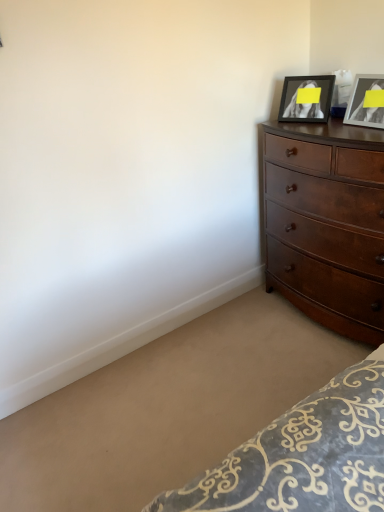
How much space does matte black picture frame at upper right, the second picture frame positioned from the left, occupy horizontally?

3.78 inches.

Measure the distance between matte black picture frame at upper right, marked as the 1th picture frame in a left-to-right arrangement, and camera.

They are 7.07 feet apart.

The height and width of the screenshot is (512, 384). What are the coordinates of `matte black picture frame at upper right, marked as the first picture frame in a right-to-left arrangement` in the screenshot? It's located at (366, 102).

Is dark brown wood dresser at right turned away from matte black picture frame at upper right, marked as the 1th picture frame in a left-to-right arrangement?

No, dark brown wood dresser at right is not facing the opposite direction of matte black picture frame at upper right, marked as the 1th picture frame in a left-to-right arrangement.

Which of these two, dark brown wood dresser at right or matte black picture frame at upper right, marked as the 1th picture frame in a left-to-right arrangement, is thinner?

With smaller width is matte black picture frame at upper right, marked as the 1th picture frame in a left-to-right arrangement.

Where is `the 2nd picture frame behind the dark brown wood dresser at right`? The image size is (384, 512). the 2nd picture frame behind the dark brown wood dresser at right is located at coordinates (306, 98).

Based on the photo, is dark brown wood dresser at right to the left or to the right of matte black picture frame at upper right, which is the 2th picture frame in right-to-left order, in the image?

dark brown wood dresser at right is positioned on matte black picture frame at upper right, which is the 2th picture frame in right-to-left order,'s right side.

Is dark brown wood dresser at right wider or thinner than matte black picture frame at upper right, marked as the first picture frame in a right-to-left arrangement?

In the image, dark brown wood dresser at right appears to be wider than matte black picture frame at upper right, marked as the first picture frame in a right-to-left arrangement.

At what (x,y) coordinates should I click in order to perform the action: click on the 1st picture frame above when counting from the dark brown wood dresser at right (from the image's perspective). Please return your answer as a coordinate pair (x, y). This screenshot has width=384, height=512. Looking at the image, I should click on (366, 102).

Is dark brown wood dresser at right far away from matte black picture frame at upper right, marked as the first picture frame in a right-to-left arrangement?

dark brown wood dresser at right is near matte black picture frame at upper right, marked as the first picture frame in a right-to-left arrangement, not far away.

Considering the relative sizes of dark brown wood dresser at right and matte black picture frame at upper right, the second picture frame positioned from the left, in the image provided, is dark brown wood dresser at right shorter than matte black picture frame at upper right, the second picture frame positioned from the left,?

No, dark brown wood dresser at right is not shorter than matte black picture frame at upper right, the second picture frame positioned from the left.

Is point (290, 110) behind point (347, 159)?

Yes, point (290, 110) is farther from viewer.

Is matte black picture frame at upper right, which is the 2th picture frame in right-to-left order, taller than dark brown wood dresser at right?

No.

Would you say dark brown wood dresser at right is part of matte black picture frame at upper right, marked as the 1th picture frame in a left-to-right arrangement,'s contents?

No, dark brown wood dresser at right is not surrounded by matte black picture frame at upper right, marked as the 1th picture frame in a left-to-right arrangement.

Can dark brown wood dresser at right be found inside matte black picture frame at upper right, the second picture frame positioned from the left?

No, dark brown wood dresser at right is not surrounded by matte black picture frame at upper right, the second picture frame positioned from the left.

Is there a large distance between matte black picture frame at upper right, the second picture frame positioned from the left, and dark brown wood dresser at right?

Actually, matte black picture frame at upper right, the second picture frame positioned from the left, and dark brown wood dresser at right are a little close together.

Based on their positions, is matte black picture frame at upper right, the second picture frame positioned from the left, located to the left or right of dark brown wood dresser at right?

Based on their positions, matte black picture frame at upper right, the second picture frame positioned from the left, is located to the left of dark brown wood dresser at right.

Which of these two, matte black picture frame at upper right, the second picture frame positioned from the left, or dark brown wood dresser at right, is bigger?

dark brown wood dresser at right.

Is matte black picture frame at upper right, which is the 2th picture frame in right-to-left order, surrounded by matte black picture frame at upper right, marked as the first picture frame in a right-to-left arrangement?

No, matte black picture frame at upper right, which is the 2th picture frame in right-to-left order, is not a part of matte black picture frame at upper right, marked as the first picture frame in a right-to-left arrangement.

From the image's perspective, is matte black picture frame at upper right, marked as the first picture frame in a right-to-left arrangement, beneath matte black picture frame at upper right, marked as the 1th picture frame in a left-to-right arrangement?

Yes, from the image's perspective, matte black picture frame at upper right, marked as the first picture frame in a right-to-left arrangement, is beneath matte black picture frame at upper right, marked as the 1th picture frame in a left-to-right arrangement.

Is matte black picture frame at upper right, marked as the first picture frame in a right-to-left arrangement, facing away from matte black picture frame at upper right, which is the 2th picture frame in right-to-left order?

matte black picture frame at upper right, marked as the first picture frame in a right-to-left arrangement, does not have its back to matte black picture frame at upper right, which is the 2th picture frame in right-to-left order.

You are a GUI agent. You are given a task and a screenshot of the screen. Output one action in this format:
    pyautogui.click(x=<x>, y=<y>)
    Task: Click on the picture frame in front of the matte black picture frame at upper right, which is the 2th picture frame in right-to-left order
    The width and height of the screenshot is (384, 512).
    Given the screenshot: What is the action you would take?
    pyautogui.click(x=366, y=102)

Which of these two, matte black picture frame at upper right, which is the 2th picture frame in right-to-left order, or matte black picture frame at upper right, the second picture frame positioned from the left, is bigger?

matte black picture frame at upper right, which is the 2th picture frame in right-to-left order, is bigger.

Are matte black picture frame at upper right, marked as the 1th picture frame in a left-to-right arrangement, and matte black picture frame at upper right, the second picture frame positioned from the left, far apart?

No, there isn't a large distance between matte black picture frame at upper right, marked as the 1th picture frame in a left-to-right arrangement, and matte black picture frame at upper right, the second picture frame positioned from the left.

Can you tell me how much matte black picture frame at upper right, which is the 2th picture frame in right-to-left order, and matte black picture frame at upper right, marked as the first picture frame in a right-to-left arrangement, differ in facing direction?

19.7 degrees.

Would you say matte black picture frame at upper right, which is the 2th picture frame in right-to-left order, is outside matte black picture frame at upper right, the second picture frame positioned from the left?

Yes.

Where is `chest of drawers below the matte black picture frame at upper right, marked as the 1th picture frame in a left-to-right arrangement (from a real-world perspective)`? chest of drawers below the matte black picture frame at upper right, marked as the 1th picture frame in a left-to-right arrangement (from a real-world perspective) is located at coordinates (326, 225).

Locate an element on the screen. Image resolution: width=384 pixels, height=512 pixels. chest of drawers in front of the matte black picture frame at upper right, marked as the first picture frame in a right-to-left arrangement is located at coordinates (326, 225).

Which object lies further to the anchor point matte black picture frame at upper right, marked as the 1th picture frame in a left-to-right arrangement, dark brown wood dresser at right or matte black picture frame at upper right, the second picture frame positioned from the left?

The object further to matte black picture frame at upper right, marked as the 1th picture frame in a left-to-right arrangement, is dark brown wood dresser at right.

Looking at the image, which one is located further to matte black picture frame at upper right, marked as the first picture frame in a right-to-left arrangement, dark brown wood dresser at right or matte black picture frame at upper right, which is the 2th picture frame in right-to-left order?

Among the two, dark brown wood dresser at right is located further to matte black picture frame at upper right, marked as the first picture frame in a right-to-left arrangement.

Based on the photo, looking at the image, which one is located closer to dark brown wood dresser at right, matte black picture frame at upper right, the second picture frame positioned from the left, or matte black picture frame at upper right, marked as the 1th picture frame in a left-to-right arrangement?

matte black picture frame at upper right, the second picture frame positioned from the left, is closer to dark brown wood dresser at right.

From the image, which object appears to be farther from dark brown wood dresser at right, matte black picture frame at upper right, which is the 2th picture frame in right-to-left order, or matte black picture frame at upper right, marked as the first picture frame in a right-to-left arrangement?

The object further to dark brown wood dresser at right is matte black picture frame at upper right, which is the 2th picture frame in right-to-left order.

From the image, which object appears to be nearer to matte black picture frame at upper right, marked as the first picture frame in a right-to-left arrangement, matte black picture frame at upper right, marked as the 1th picture frame in a left-to-right arrangement, or dark brown wood dresser at right?

matte black picture frame at upper right, marked as the 1th picture frame in a left-to-right arrangement, is closer to matte black picture frame at upper right, marked as the first picture frame in a right-to-left arrangement.

Looking at the image, which one is located further to matte black picture frame at upper right, marked as the 1th picture frame in a left-to-right arrangement, matte black picture frame at upper right, the second picture frame positioned from the left, or dark brown wood dresser at right?

dark brown wood dresser at right is positioned further to the anchor matte black picture frame at upper right, marked as the 1th picture frame in a left-to-right arrangement.

I want to click on picture frame between matte black picture frame at upper right, marked as the 1th picture frame in a left-to-right arrangement, and dark brown wood dresser at right from top to bottom, so click(366, 102).